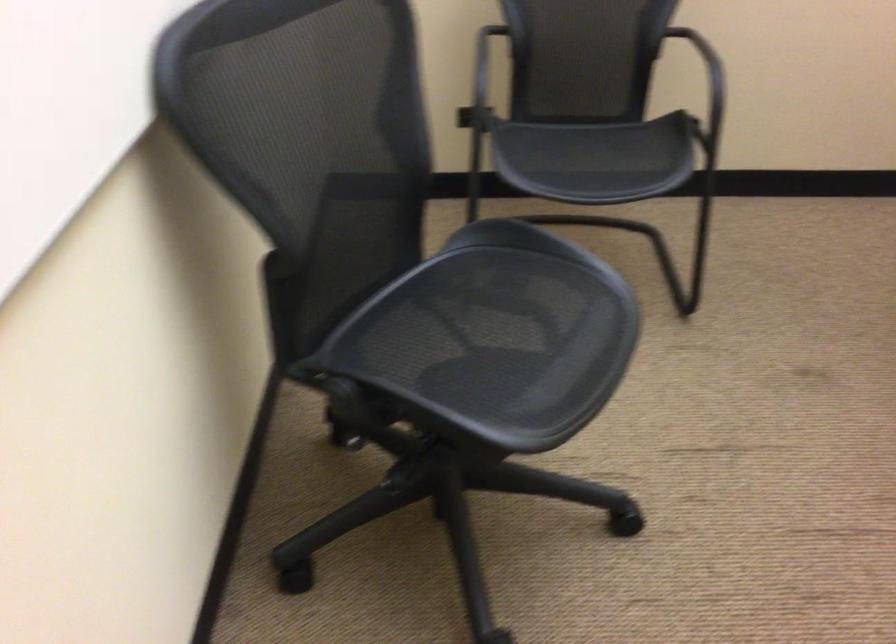
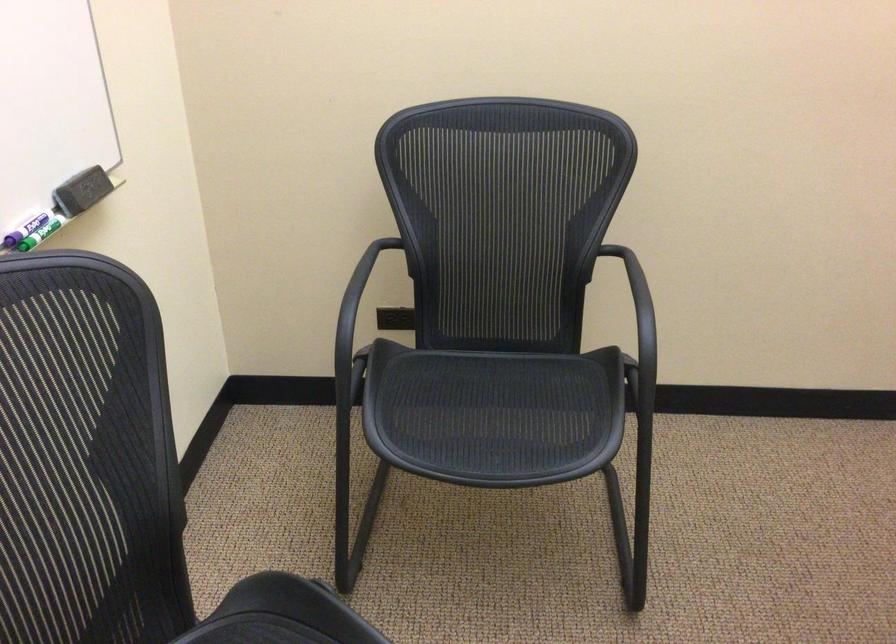
Where in the second image is the point corresponding to point (584, 151) from the first image?

(478, 413)